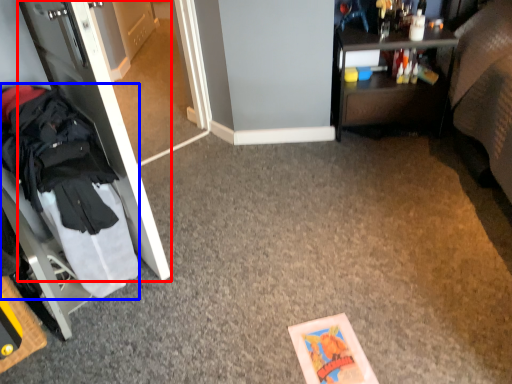
Question: Which point is further to the camera, door (highlighted by a red box) or clothing (highlighted by a blue box)?

Choices:
 (A) door
 (B) clothing

Answer: (B)